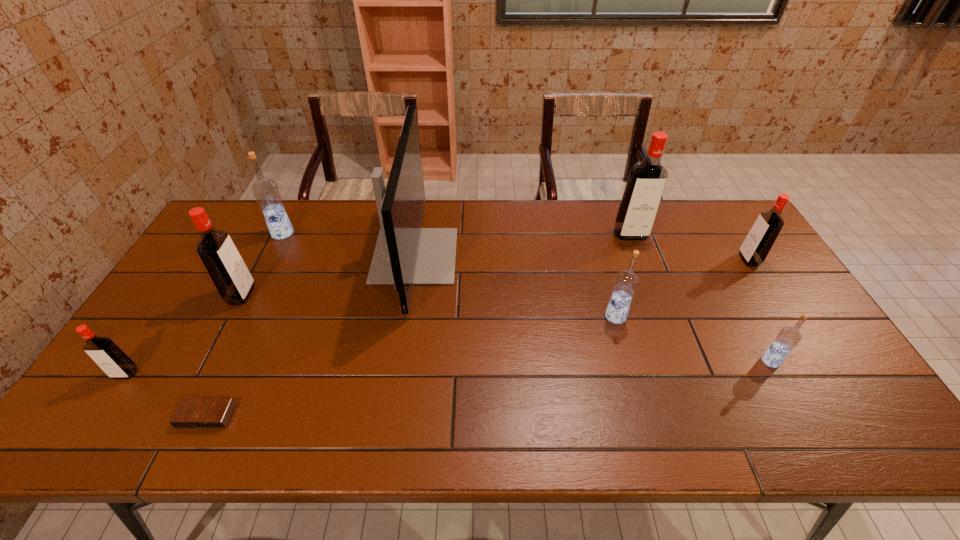
Image resolution: width=960 pixels, height=540 pixels. Find the location of `the second nearest blue vodka`. the second nearest blue vodka is located at coordinates (626, 282).

I want to click on the sixth vodka from left to right, so click(788, 337).

The image size is (960, 540). I want to click on the second object from right to left, so click(x=788, y=337).

Image resolution: width=960 pixels, height=540 pixels. In order to click on the leftmost vodka in this screenshot , I will do `click(105, 353)`.

You are a GUI agent. You are given a task and a screenshot of the screen. Output one action in this format:
    pyautogui.click(x=<x>, y=<y>)
    Task: Click on the leftmost object
    
    Given the screenshot: What is the action you would take?
    pyautogui.click(x=105, y=353)

At what (x,y) coordinates should I click in order to perform the action: click on alarm clock. Please return your answer as a coordinate pair (x, y). Image resolution: width=960 pixels, height=540 pixels. Looking at the image, I should click on (191, 412).

Find the location of a particular element. the shortest object is located at coordinates (191, 412).

This screenshot has height=540, width=960. Identify the location of vacant area located 0.290m on the screen of the fifth object from right to left. (x=547, y=256).

Identify the location of vacant space located on the front and back of the third vodka from right to left. The height and width of the screenshot is (540, 960). (671, 341).

Identify the location of vacant space located 0.360m on the front of the leftmost blue vodka. The height and width of the screenshot is (540, 960). (236, 326).